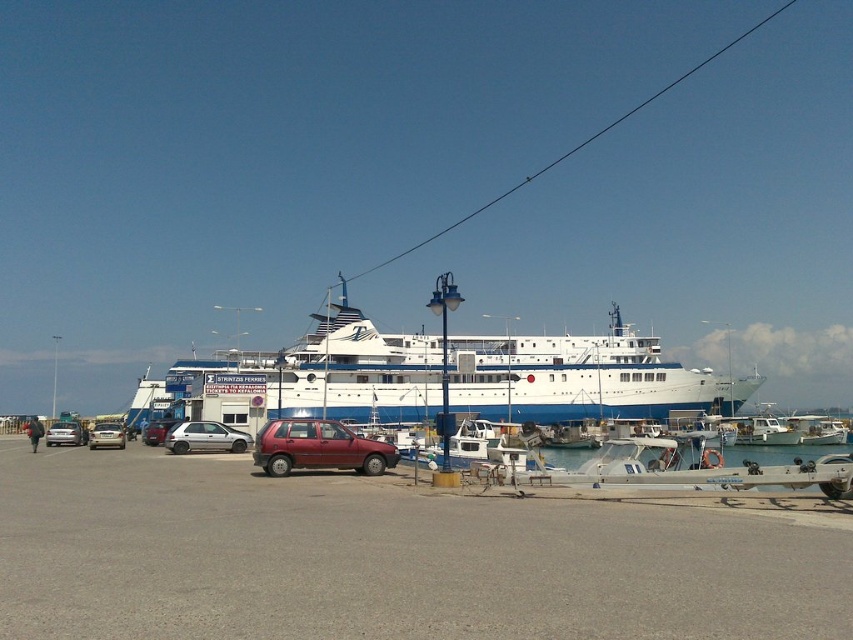
Does gray asphalt parking lot at center have a smaller size compared to white glossy cruise ship at center?

Correct, gray asphalt parking lot at center occupies less space than white glossy cruise ship at center.

Is point (67, 480) less distant than point (427, 381)?

Yes, it is.

Describe the element at coordinates (386, 560) in the screenshot. This screenshot has height=640, width=853. I see `gray asphalt parking lot at center` at that location.

Find the location of `gray asphalt parking lot at center`. gray asphalt parking lot at center is located at coordinates (386, 560).

Can you confirm if silver metallic car at center is smaller than silver metallic car at left?

No.

Does point (93, 440) come behind point (56, 435)?

No.

The image size is (853, 640). What do you see at coordinates (106, 435) in the screenshot?
I see `silver metallic car at center` at bounding box center [106, 435].

I want to click on silver metallic car at center, so 106,435.

Is silver metallic car at center below matte red car at center?

Yes.

Who is more forward, (96, 433) or (152, 438)?

Point (96, 433) is more forward.

Which is in front, point (96, 433) or point (163, 435)?

Point (96, 433)

You are a GUI agent. You are given a task and a screenshot of the screen. Output one action in this format:
    pyautogui.click(x=<x>, y=<y>)
    Task: Click on the silver metallic car at center
    The image size is (853, 640).
    Given the screenshot: What is the action you would take?
    pyautogui.click(x=106, y=435)